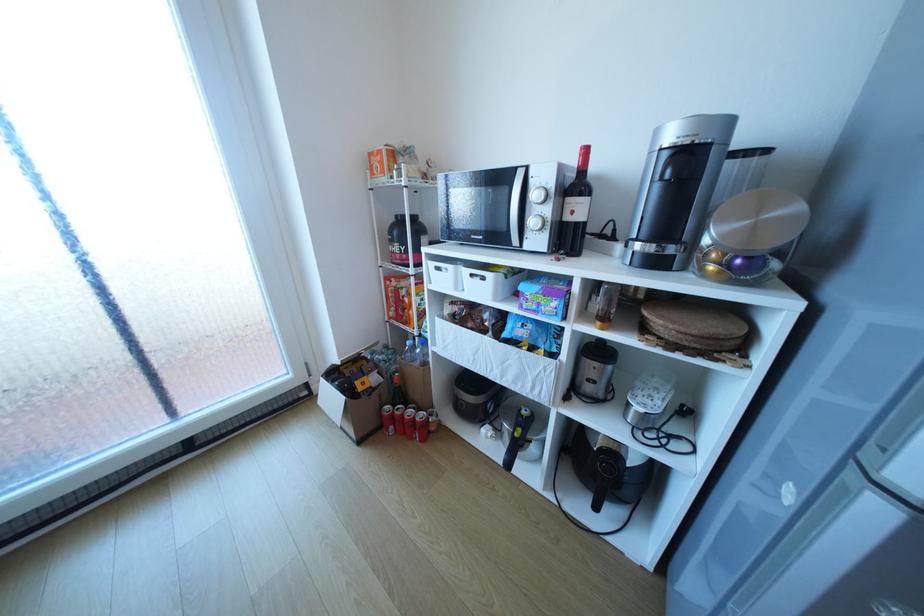
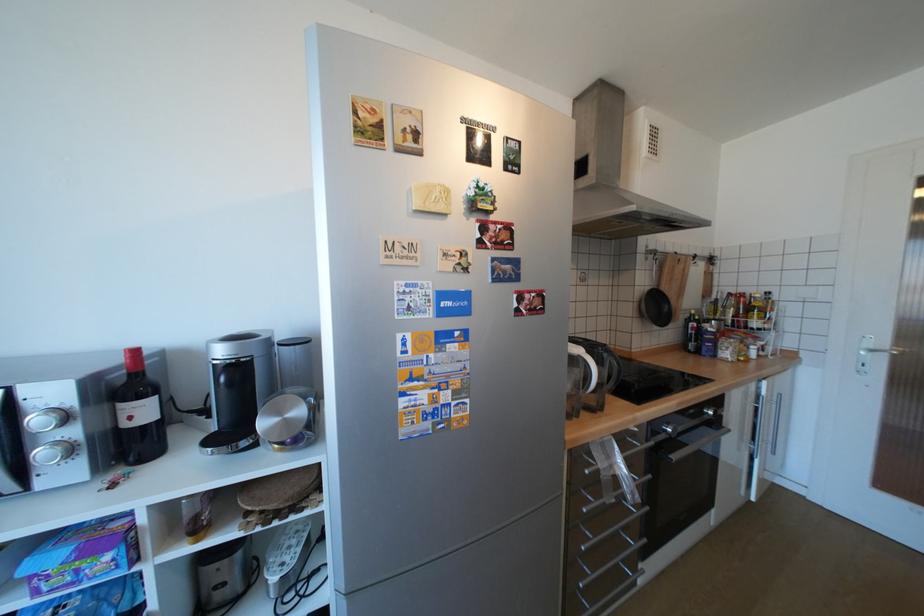
In the second image, find the point that corresponds to point (542, 195) in the first image.

(46, 419)